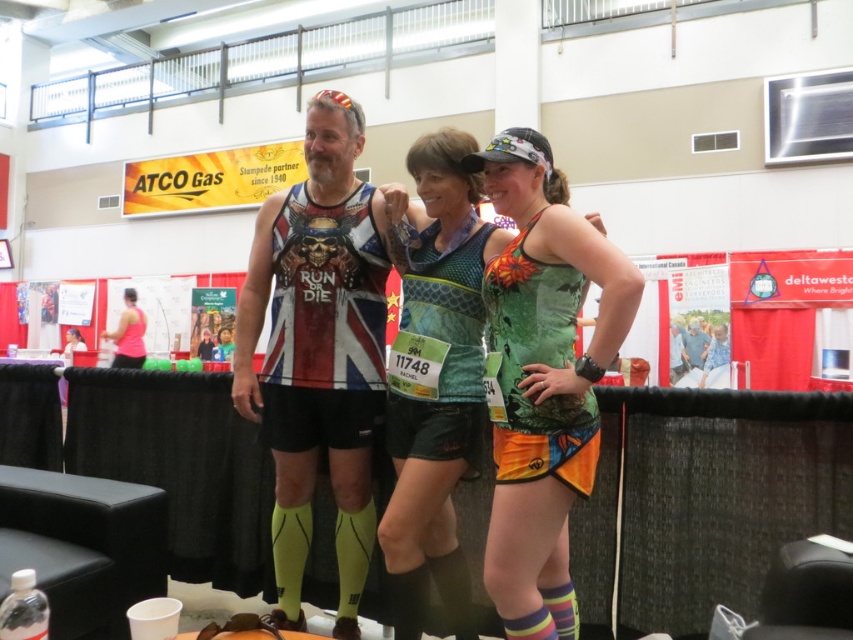
You are standing at the entrance of the venue and want to locate the matte jersey at center. Based on the coordinates provided, where should you look relative to the image frame?

The matte jersey at center is located at the coordinates point (318, 353), which is slightly to the right and a bit below the center of the image frame.

You are a photographer at the event. You want to take a photo that includes both the matte jersey at center and the pink fabric tank top at left. Which one should you focus on first to ensure both are in frame?

The matte jersey at center is located above the pink fabric tank top at left, so you should focus on the pink fabric tank top at left first to ensure both are in frame.

You are a photographer at the event and need to position yourself so that both the green camouflage tank top at center and the matte black tank top at center are visible in your shot. Given their positions relative to each other, which direction should you face to ensure both are in frame?

You should face towards the right side of the green camouflage tank top at center and the left side of the matte black tank top at center since the green camouflage tank top at center is to the left of the matte black tank top at center.